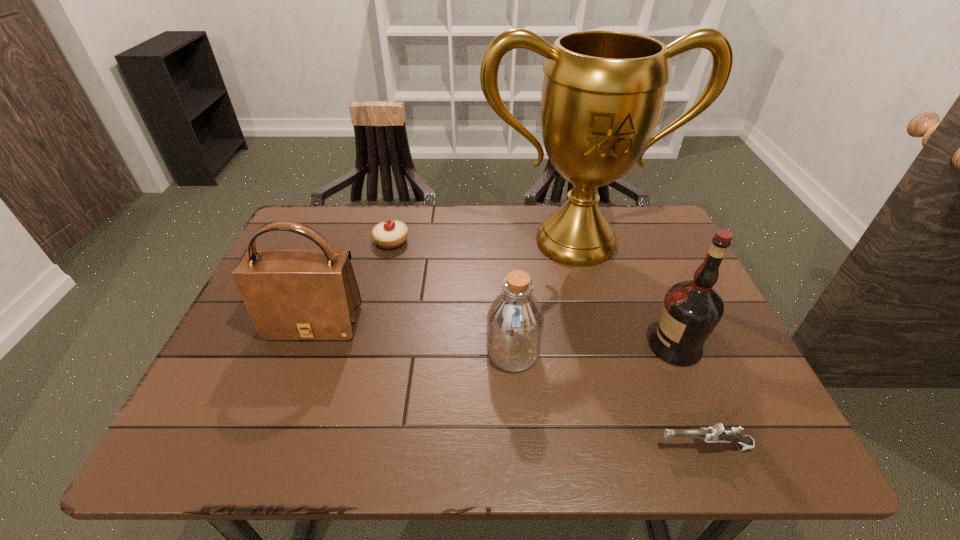
Where is `object identified as the fourth closest to the shoulder bag`? object identified as the fourth closest to the shoulder bag is located at coordinates 717,433.